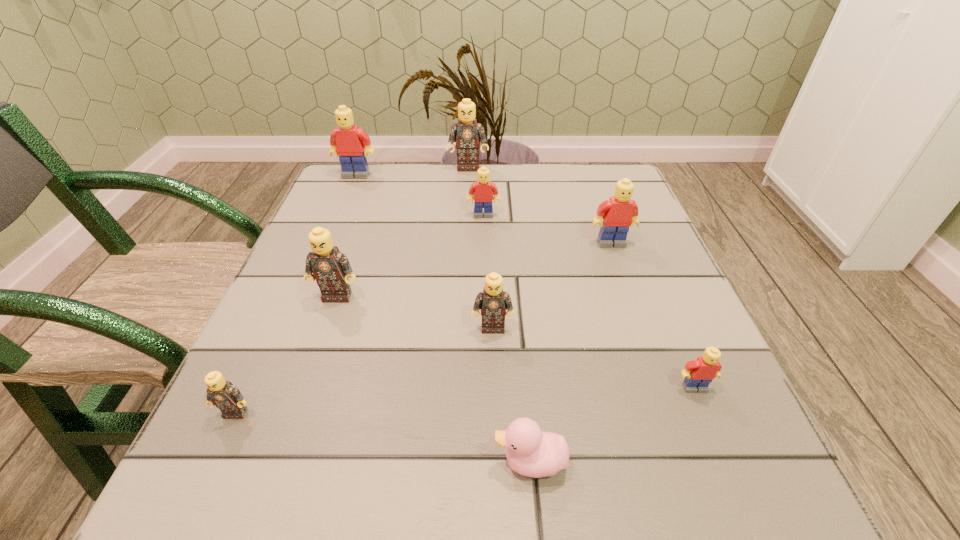
Where is `the biggest yellow Lego`? the biggest yellow Lego is located at coordinates (348, 142).

This screenshot has width=960, height=540. I want to click on the leftmost yellow Lego, so click(348, 142).

I want to click on the farthest tan Lego, so click(x=469, y=133).

Identify the location of the fourth farthest object. The height and width of the screenshot is (540, 960). (619, 213).

Where is `the fifth nearest Lego`? the fifth nearest Lego is located at coordinates (619, 213).

At what (x,y) coordinates should I click in order to perform the action: click on the third smallest tan Lego. Please return your answer as a coordinate pair (x, y). Looking at the image, I should click on (330, 267).

The width and height of the screenshot is (960, 540). I want to click on the fifth farthest Lego, so click(x=330, y=267).

This screenshot has height=540, width=960. In order to click on the third biggest yellow Lego in this screenshot , I will do `click(482, 191)`.

The image size is (960, 540). In order to click on the third yellow Lego from right to left in this screenshot , I will do `click(482, 191)`.

I want to click on the second smallest tan Lego, so click(493, 302).